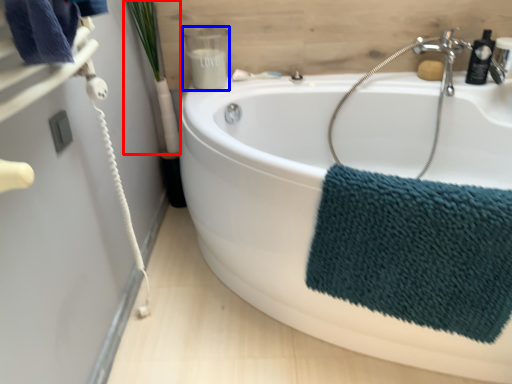
Question: Among these objects, which one is nearest to the camera, plant (highlighted by a red box) or toiletry (highlighted by a blue box)?

Choices:
 (A) plant
 (B) toiletry

Answer: (A)